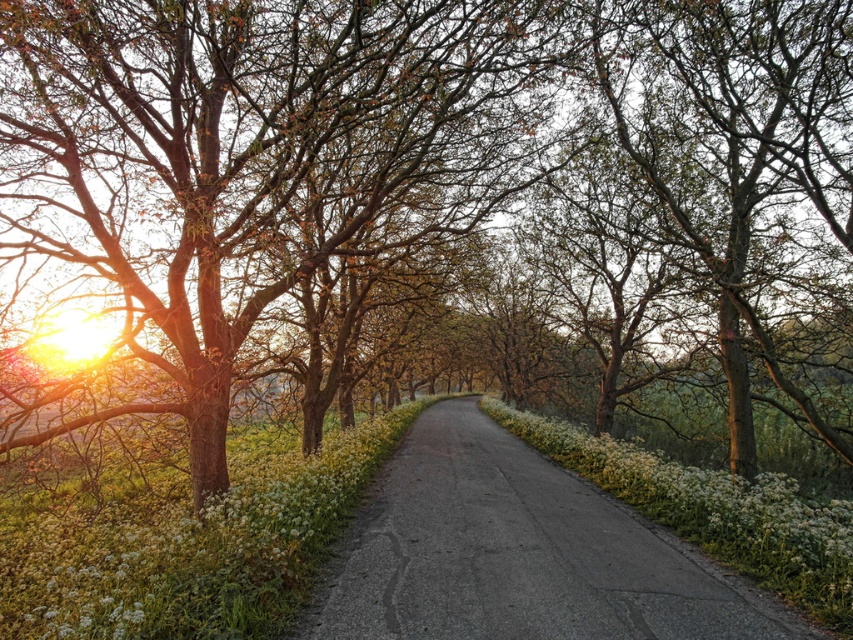
Question: Can you confirm if brown textured tree at left is positioned above asphalt road at center?

Choices:
 (A) no
 (B) yes

Answer: (B)

Question: Which of the following is the closest to the observer?

Choices:
 (A) asphalt road at center
 (B) brown textured tree at left
 (C) white matte flower at center-left

Answer: (C)

Question: Which of the following is the farthest from the observer?

Choices:
 (A) (292, 451)
 (B) (347, 65)
 (C) (384, 634)

Answer: (A)

Question: Among these points, which one is nearest to the camera?

Choices:
 (A) (634, 636)
 (B) (241, 582)

Answer: (A)

Question: Can you confirm if brown textured tree at left is thinner than white matte flower at center-left?

Choices:
 (A) no
 (B) yes

Answer: (A)

Question: Considering the relative positions of brown textured tree at left and white matte flower at center-left in the image provided, where is brown textured tree at left located with respect to white matte flower at center-left?

Choices:
 (A) below
 (B) above

Answer: (B)